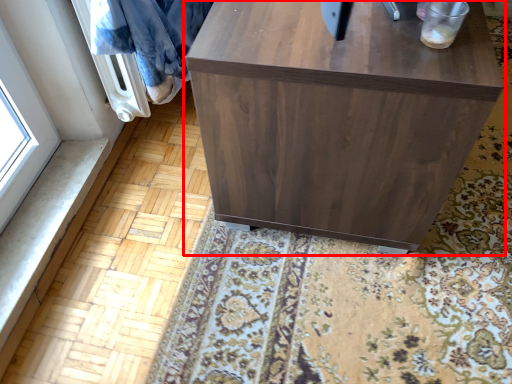
Question: Where is furniture (annotated by the red box) located in relation to blanket in the image?

Choices:
 (A) left
 (B) right

Answer: (B)